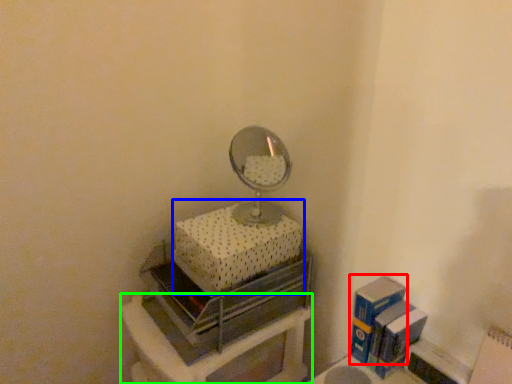
Question: Considering the real-world distances, which object is farthest from box (highlighted by a red box)? box (highlighted by a blue box) or furniture (highlighted by a green box)?

Choices:
 (A) box
 (B) furniture

Answer: (A)